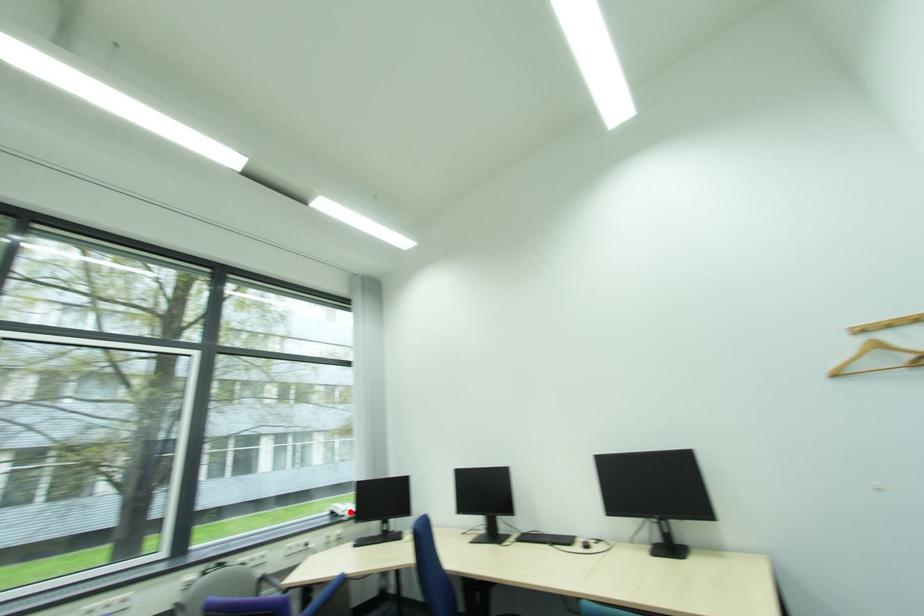
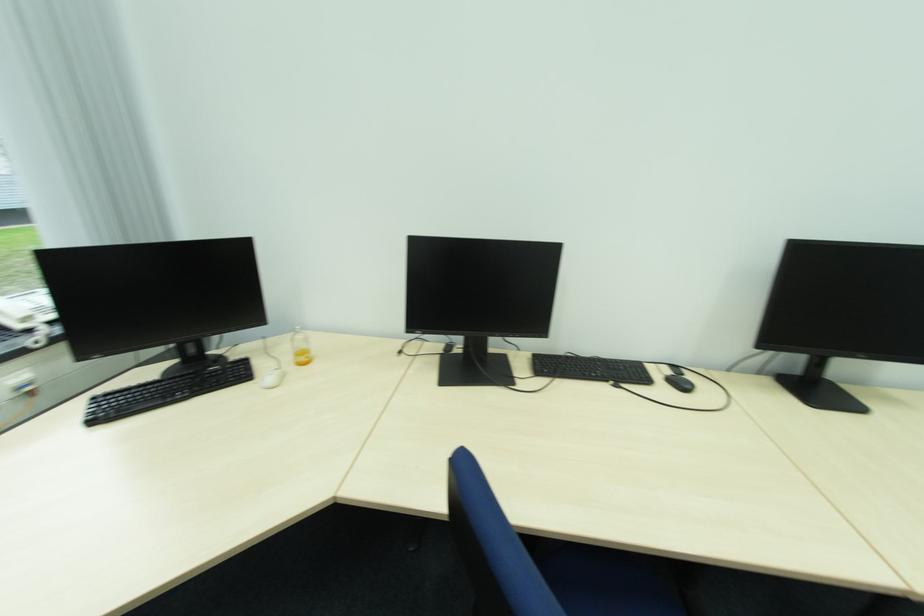
Question: I am providing you with two images of the same scene from different viewpoints. A red point is marked on the first image. Can you still see the location of the red point in image 2?

Choices:
 (A) Yes
 (B) No

Answer: (A)